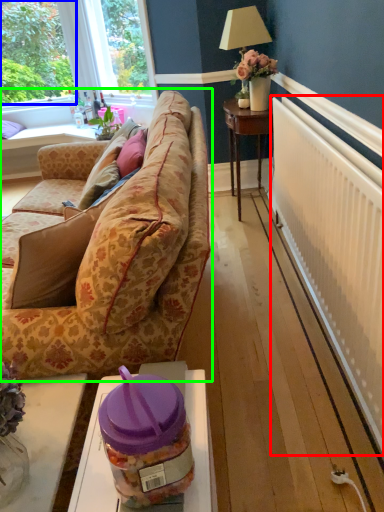
Question: Estimate the real-world distances between objects in this image. Which object is closer to radiator (highlighted by a red box), plant (highlighted by a blue box) or studio couch (highlighted by a green box)?

Choices:
 (A) plant
 (B) studio couch

Answer: (B)